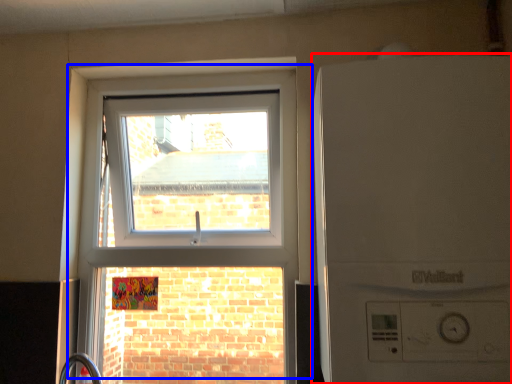
Question: Among these objects, which one is farthest to the camera, washing machine (highlighted by a red box) or window (highlighted by a blue box)?

Choices:
 (A) washing machine
 (B) window

Answer: (B)